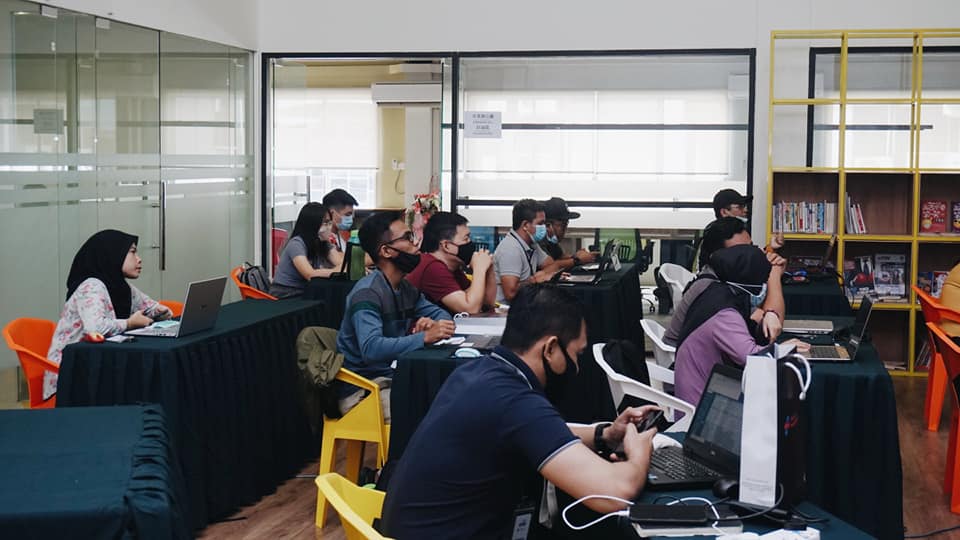
At what (x,y) coordinates should I click in order to perform the action: click on shelves. Please return your answer as a coordinate pair (x, y). Looking at the image, I should click on (822, 213), (890, 268), (894, 330).